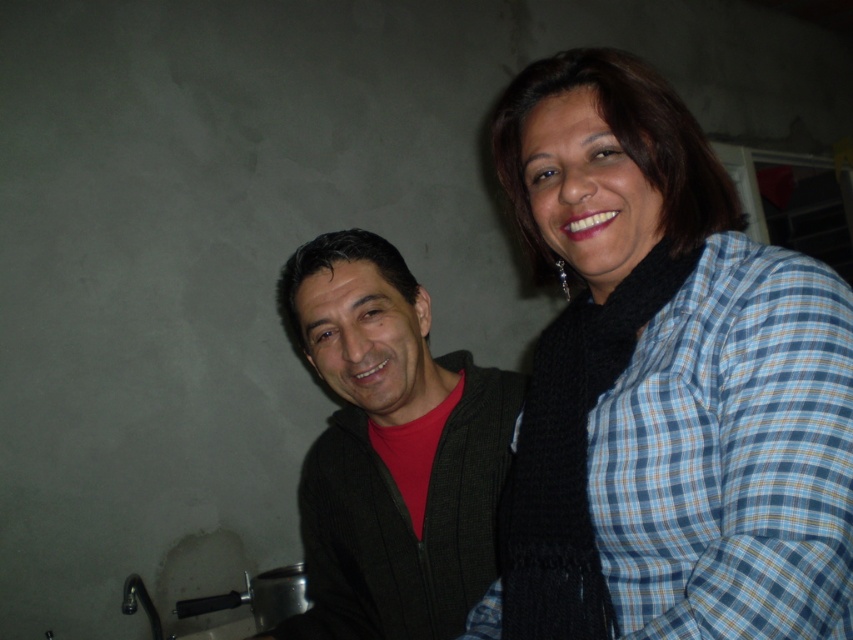
In the scene shown: You are a photographer setting up for a portrait session. You have a camera that requires a minimum distance of 30 inches from the subject to focus properly. You need to position the subject at point (582, 323). Is the current distance sufficient for your camera to focus?

The distance between the camera and point (582, 323) is 35.52 inches, which is greater than the minimum required 30 inches. Therefore, the camera can focus properly at this distance.

You are trying to decide which clothing item to purchase between the blue plaid shirt at upper right and the dark green sweater at center. Based on their positions in the image, which one appears closer to the right side of the frame?

The blue plaid shirt at upper right is positioned to the right of the dark green sweater at center, so it is closer to the right side of the frame.

You are a photographer trying to adjust the lighting for a group photo. You notice the blue plaid shirt at upper right and the dark green sweater at center. Which clothing item is closer to the light source coming from the window on the right side of the frame?

The blue plaid shirt at upper right is in front of the dark green sweater at center, so it is closer to the light source coming from the window on the right side of the frame.